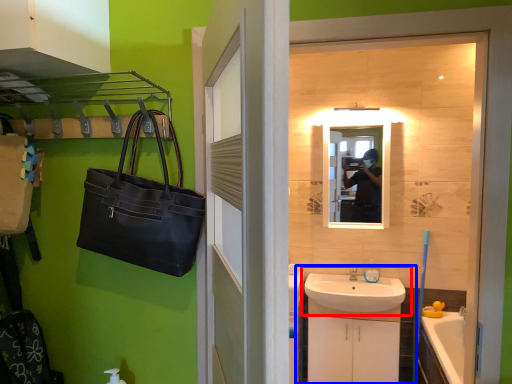
Question: Which of the following is the farthest to the observer, sink (highlighted by a red box) or bathroom cabinet (highlighted by a blue box)?

Choices:
 (A) sink
 (B) bathroom cabinet

Answer: (B)